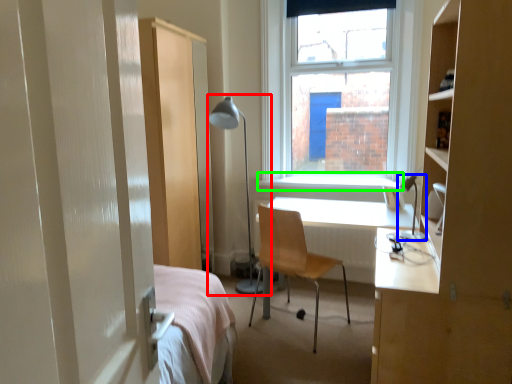
Question: Considering the real-world distances, which object is farthest from table lamp (highlighted by a red box)? table lamp (highlighted by a blue box) or window sill (highlighted by a green box)?

Choices:
 (A) table lamp
 (B) window sill

Answer: (A)